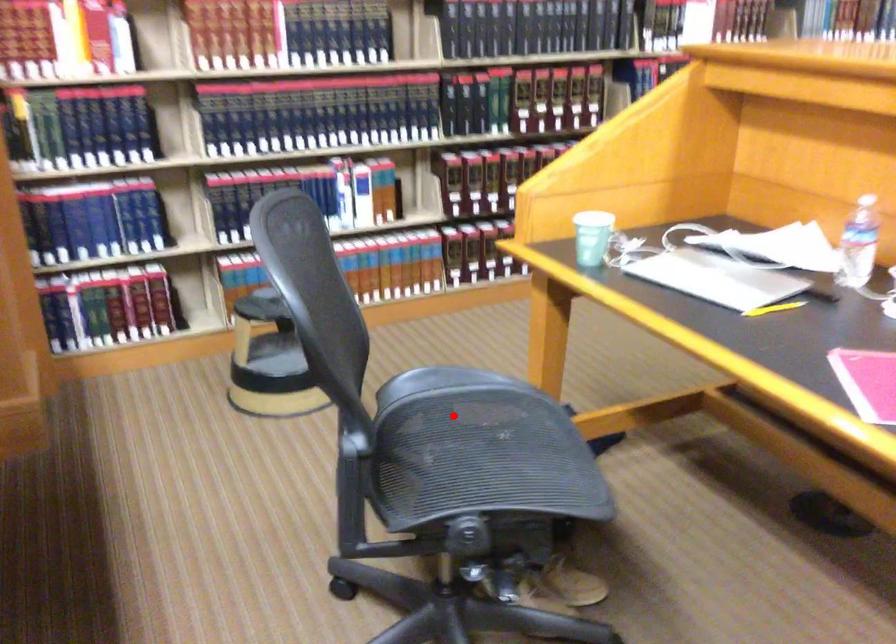
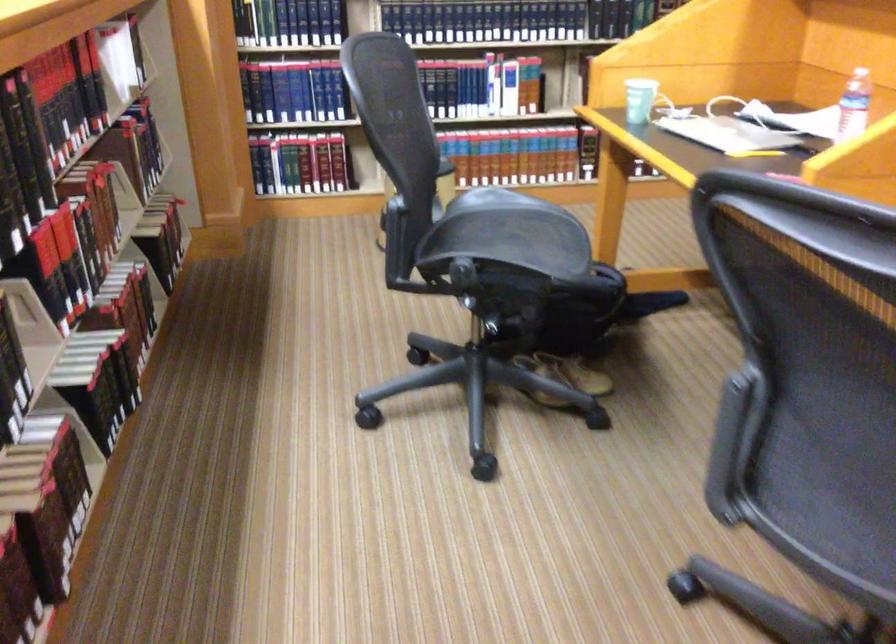
Locate, in the second image, the point that corresponds to the highlighted location in the first image.

(500, 221)